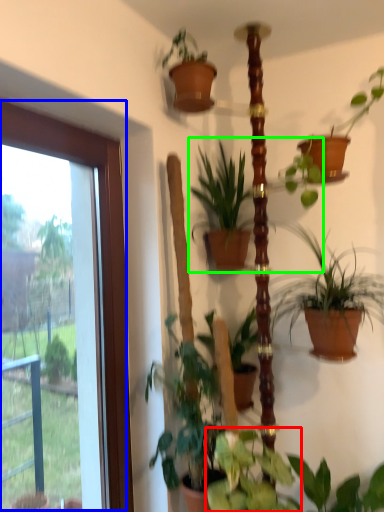
Question: Estimate the real-world distances between objects in this image. Which object is closer to houseplant (highlighted by a red box), window (highlighted by a blue box) or houseplant (highlighted by a green box)?

Choices:
 (A) window
 (B) houseplant

Answer: (A)